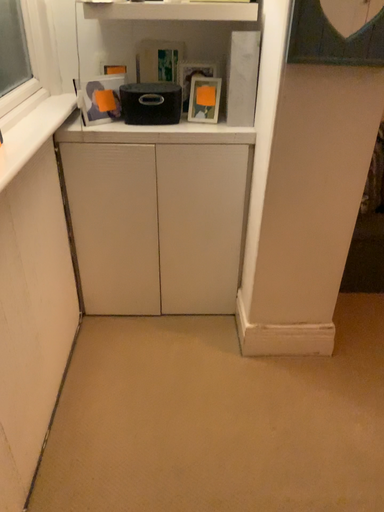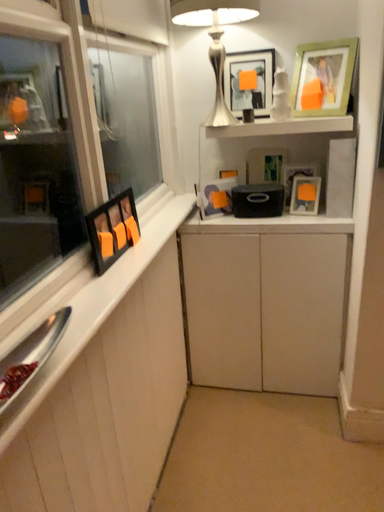
Question: How did the camera likely rotate when shooting the video?

Choices:
 (A) rotated downward
 (B) rotated upward

Answer: (B)